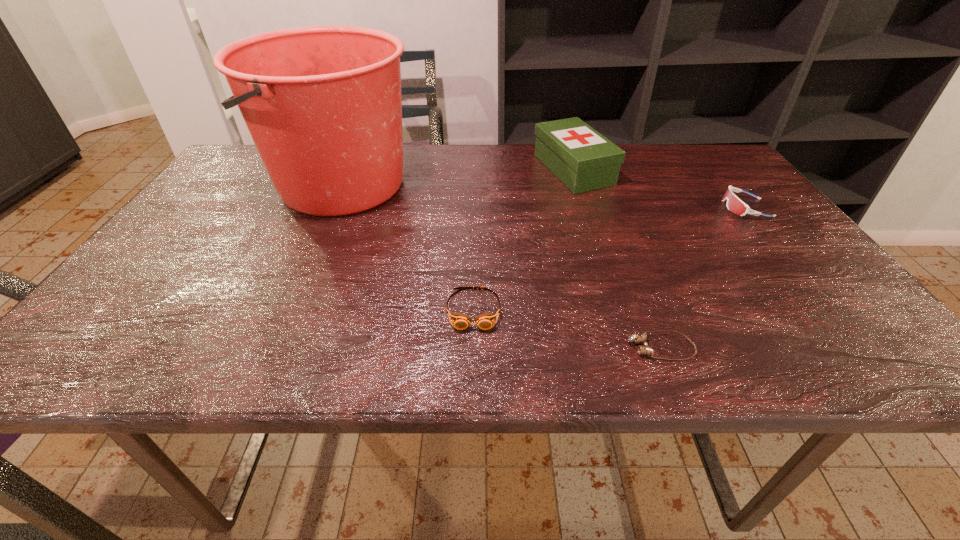
This screenshot has width=960, height=540. Find the location of `bucket`. bucket is located at coordinates (323, 105).

Locate an element on the screen. Image resolution: width=960 pixels, height=540 pixels. the tallest object is located at coordinates (323, 105).

Locate an element on the screen. This screenshot has height=540, width=960. the second tallest object is located at coordinates (581, 158).

Where is `the third shortest object`? the third shortest object is located at coordinates coord(734,204).

Identify the location of the farthest goggles. The width and height of the screenshot is (960, 540). (734, 204).

Where is `the second shortest goggles`? This screenshot has height=540, width=960. the second shortest goggles is located at coordinates (459, 321).

Identify the location of the second nearest goggles. (459, 321).

Find the location of `the nearest object`. the nearest object is located at coordinates (644, 349).

The width and height of the screenshot is (960, 540). I want to click on the second goggles from left to right, so pyautogui.click(x=644, y=349).

Locate an element on the screen. This screenshot has height=540, width=960. vacant space situated 0.160m on the front of the leftmost object is located at coordinates (300, 274).